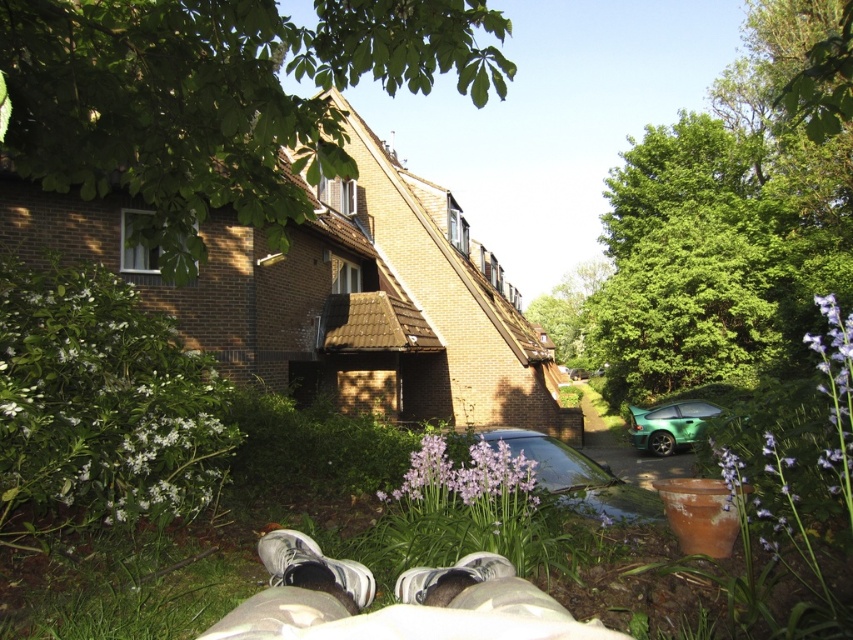
Question: Among these objects, which one is farthest from the camera?

Choices:
 (A) white textured shoe at lower center
 (B) purple matte flower at center
 (C) white fabric shoe at lower center

Answer: (B)

Question: Is white fabric shoes at lower center to the left of white textured shoe at lower center from the viewer's perspective?

Choices:
 (A) yes
 (B) no

Answer: (B)

Question: Is white fabric shoes at lower center above purple matte flower at right?

Choices:
 (A) yes
 (B) no

Answer: (B)

Question: Is white matte bush at lower left positioned in front of purple matte flower at right?

Choices:
 (A) no
 (B) yes

Answer: (A)

Question: Which point is farther to the camera?

Choices:
 (A) (573, 493)
 (B) (120, 563)
 (C) (689, 400)

Answer: (C)

Question: Among these objects, which one is farthest from the camera?

Choices:
 (A) green metallic car at right
 (B) white matte bush at lower left
 (C) shiny metallic car at center

Answer: (A)